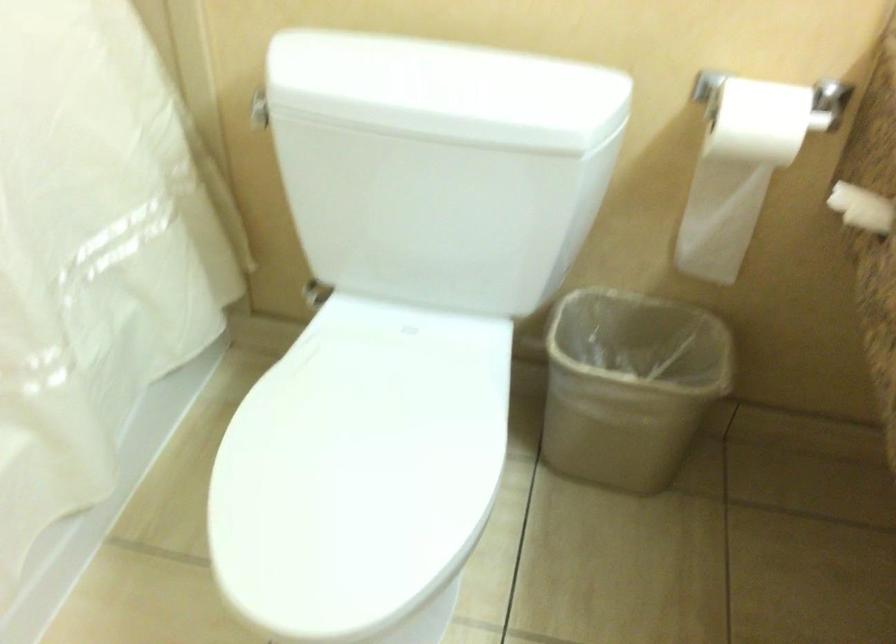
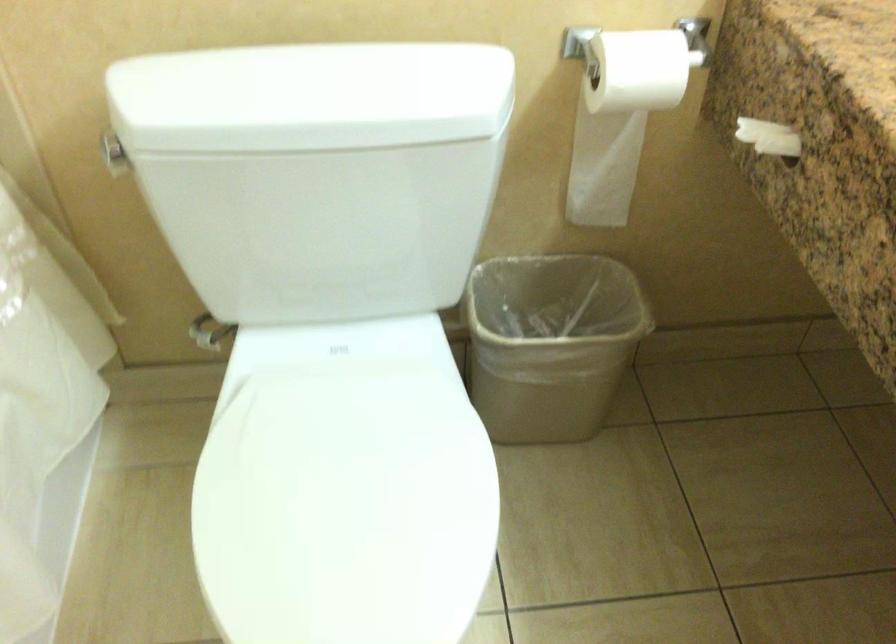
Which direction would the cameraman need to move to produce the second image?

The movement direction of the cameraman is left, forward.